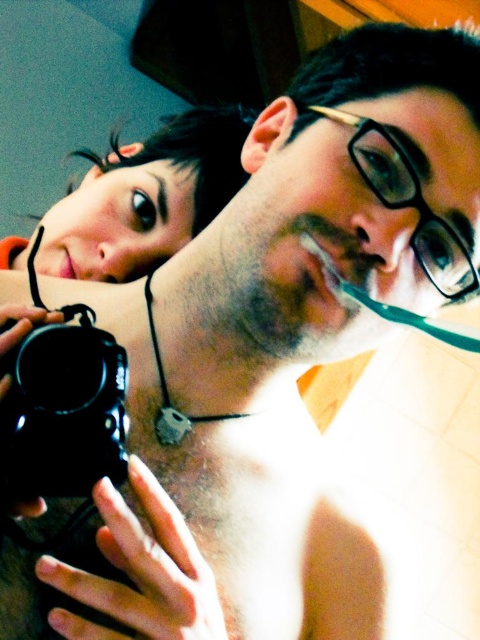
Can you confirm if matte black hair at upper left is positioned below black plastic camera at lower left?

No, matte black hair at upper left is not below black plastic camera at lower left.

Can you confirm if matte black hair at upper left is thinner than black plastic camera at lower left?

Incorrect, matte black hair at upper left's width is not less than black plastic camera at lower left's.

Find the location of `matte black hair at upper left`. matte black hair at upper left is located at coordinates (148, 196).

From the picture: Does black plastic camera at lower left appear on the left side of pink matte lips at upper left?

In fact, black plastic camera at lower left is to the right of pink matte lips at upper left.

Where is `black plastic camera at lower left`? This screenshot has width=480, height=640. black plastic camera at lower left is located at coordinates (62, 412).

Identify the location of black plastic camera at lower left. The image size is (480, 640). (62, 412).

Looking at this image, does matte black hair at upper left lie in front of pink matte lips at upper left?

Yes.

Is point (94, 278) less distant than point (63, 260)?

Yes.

At what (x,y) coordinates should I click in order to perform the action: click on matte black hair at upper left. Please return your answer as a coordinate pair (x, y). This screenshot has height=640, width=480. Looking at the image, I should click on (148, 196).

The width and height of the screenshot is (480, 640). Identify the location of matte black hair at upper left. (148, 196).